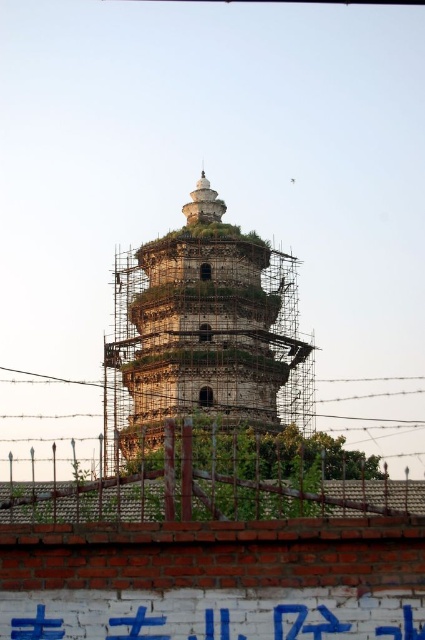
You are a construction worker who needs to move a 20 meter long steel beam from the brick fence at lower center to the white painted brick wall at lower center. Can you move the beam without bending it?

The distance between the brick fence at lower center and the white painted brick wall at lower center is 18.76 meters, which is shorter than the beam length of 20 meters. Therefore, the beam cannot be moved straight without bending it.

You are a visitor standing in front of the pagoda and see the brick fence at lower center and the white painted brick wall at lower center. Which one is positioned to the left?

The brick fence at lower center is positioned to the left of the white painted brick wall at lower center.

You are a construction worker standing at the entrance of the pagoda. You need to measure the distance between the white painted brick wall at lower center and the nearest arched opening on the pagoda. Can you estimate how far apart they are?

The distance of white painted brick wall at lower center from viewer is 228.82 feet, but the distance to the nearest arched opening on the pagoda is not provided in the description. Therefore, I cannot estimate the distance between them.